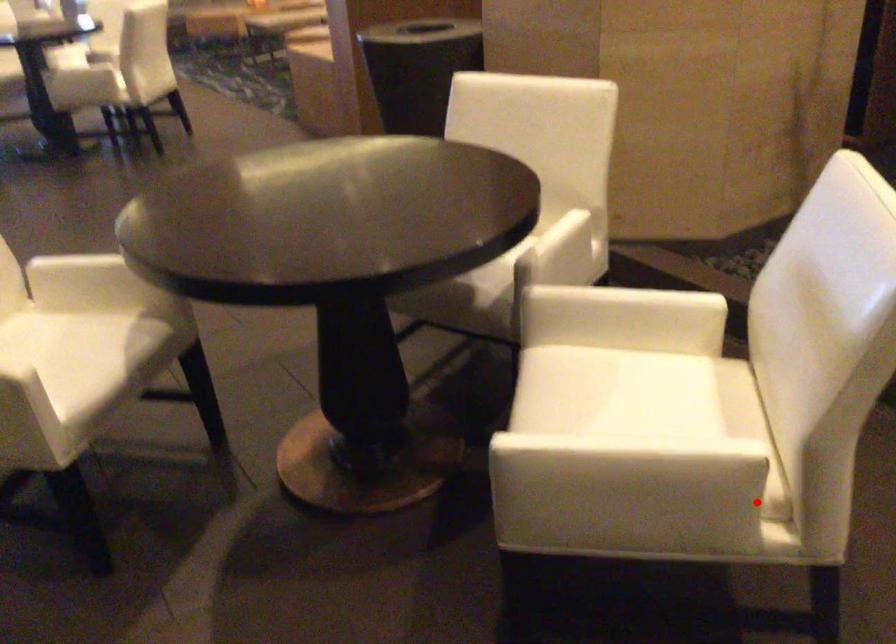
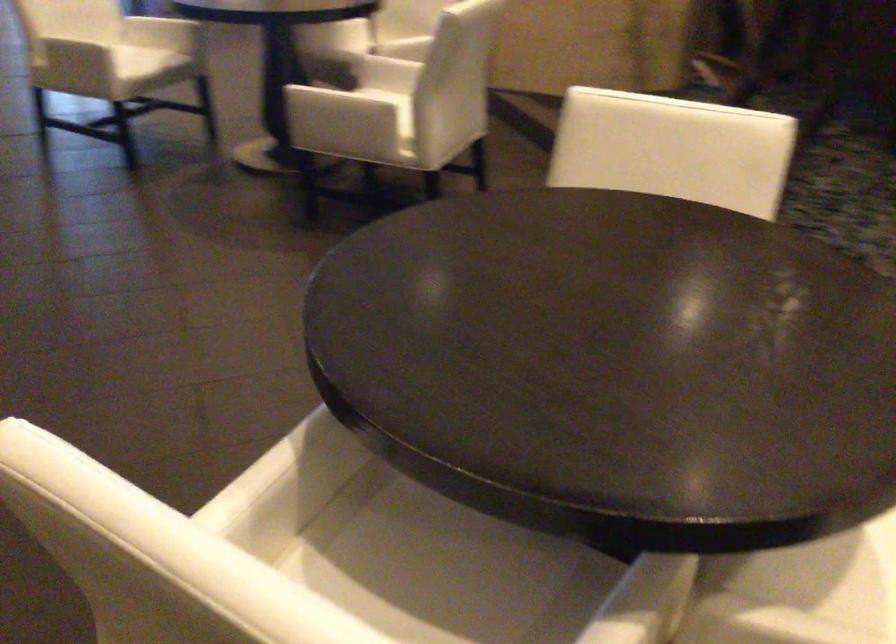
Question: I am providing you with two images of the same scene from different viewpoints. In image1, a red point is highlighted. Considering the same 3D point in image2, which of the following is correct?

Choices:
 (A) It is closer
 (B) It is farther

Answer: (B)